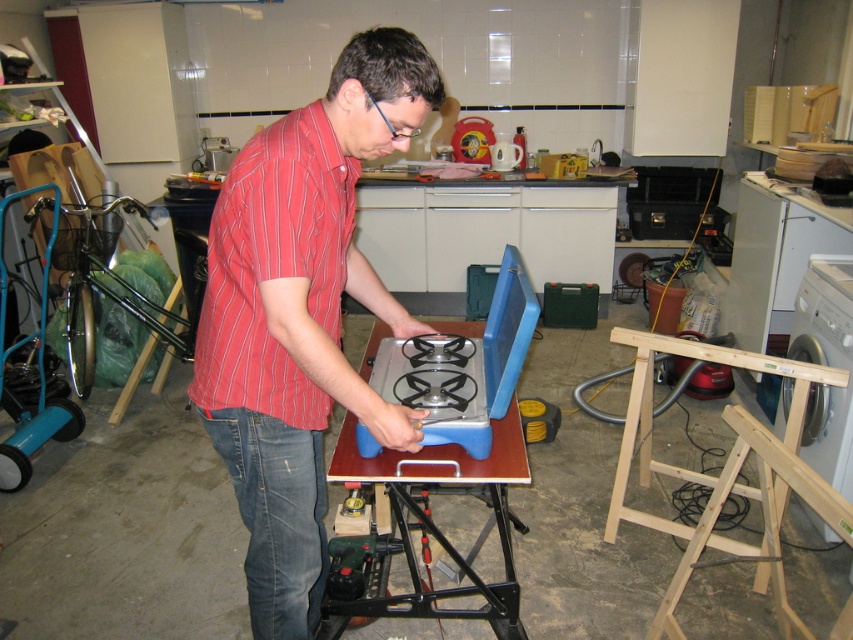
Question: Is denim at left closer to the viewer compared to blue plastic gas stove at center?

Choices:
 (A) no
 (B) yes

Answer: (B)

Question: Which point appears closest to the camera in this image?

Choices:
 (A) (257, 388)
 (B) (461, 452)
 (C) (456, 420)

Answer: (A)

Question: Which point appears closest to the camera in this image?

Choices:
 (A) coord(366,32)
 (B) coord(461,472)
 (C) coord(245,570)

Answer: (A)

Question: Which of the following is the farthest from the observer?

Choices:
 (A) blue plastic table at center
 (B) blue plastic gas stove at center
 (C) red striped shirt at center
 (D) denim at left

Answer: (B)

Question: Considering the relative positions of red striped shirt at center and blue plastic gas stove at center in the image provided, where is red striped shirt at center located with respect to blue plastic gas stove at center?

Choices:
 (A) left
 (B) right

Answer: (A)

Question: Does red striped shirt at center have a lesser width compared to blue plastic gas stove at center?

Choices:
 (A) no
 (B) yes

Answer: (A)